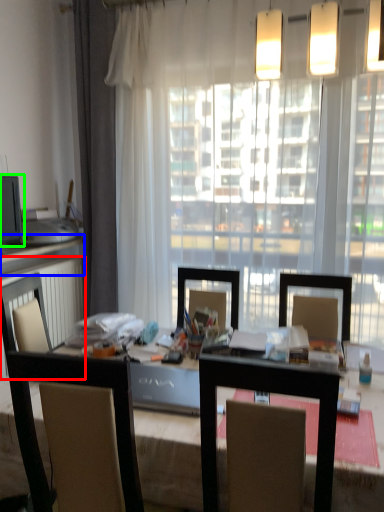
Question: Which is nearer to the radiator (highlighted by a red box)? counter top (highlighted by a blue box) or computer monitor (highlighted by a green box).

Choices:
 (A) counter top
 (B) computer monitor

Answer: (A)